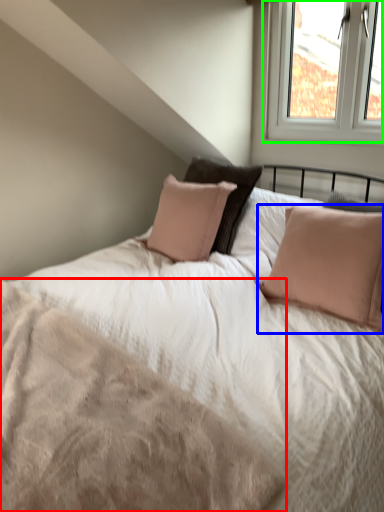
Question: Estimate the real-world distances between objects in this image. Which object is farther from mattress (highlighted by a red box), pillow (highlighted by a blue box) or window (highlighted by a green box)?

Choices:
 (A) pillow
 (B) window

Answer: (B)